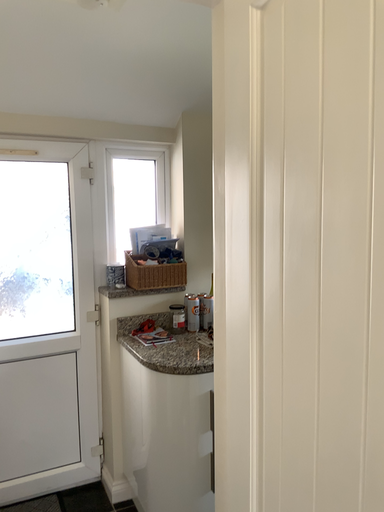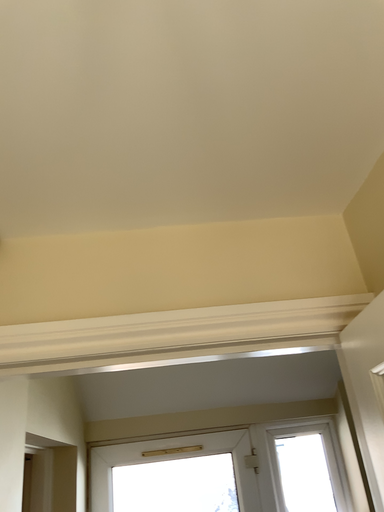
Question: Which way did the camera rotate in the video?

Choices:
 (A) rotated upward
 (B) rotated downward

Answer: (A)